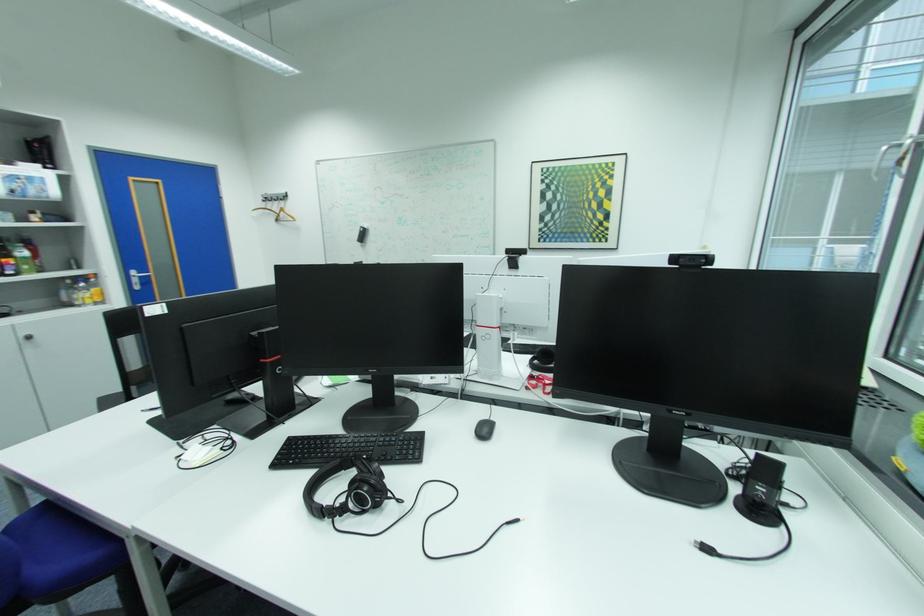
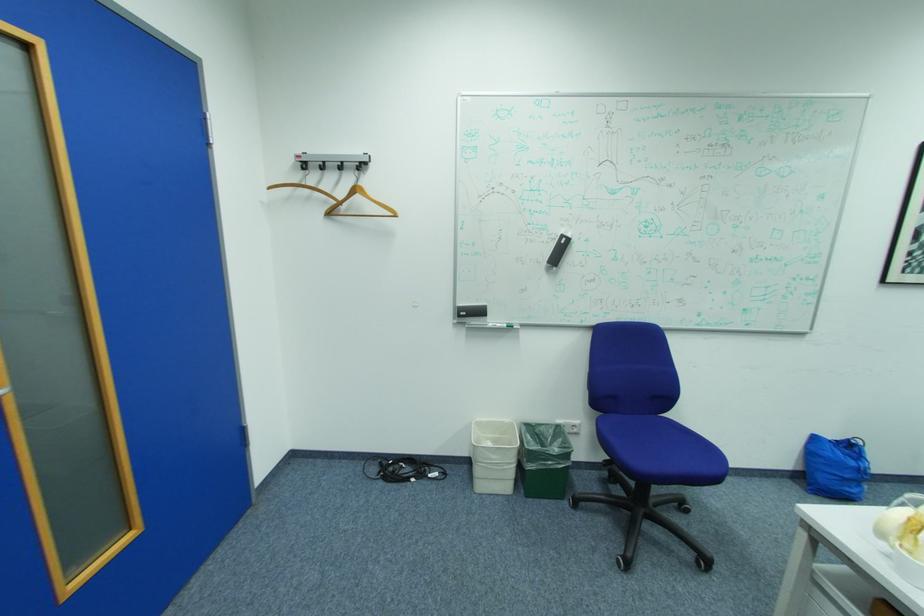
Locate, in the second image, the point that corresponds to point (290, 213) in the first image.

(366, 197)